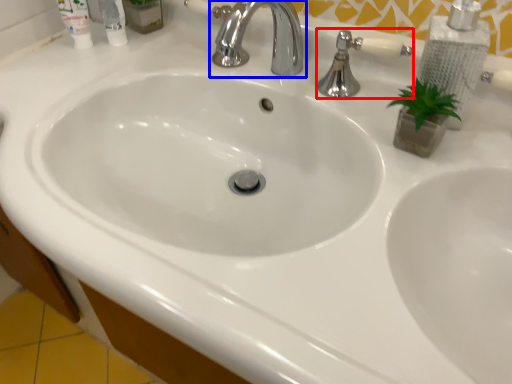
Question: Which object is closer to the camera taking this photo, plumbing fixture (highlighted by a red box) or tap (highlighted by a blue box)?

Choices:
 (A) plumbing fixture
 (B) tap

Answer: (B)